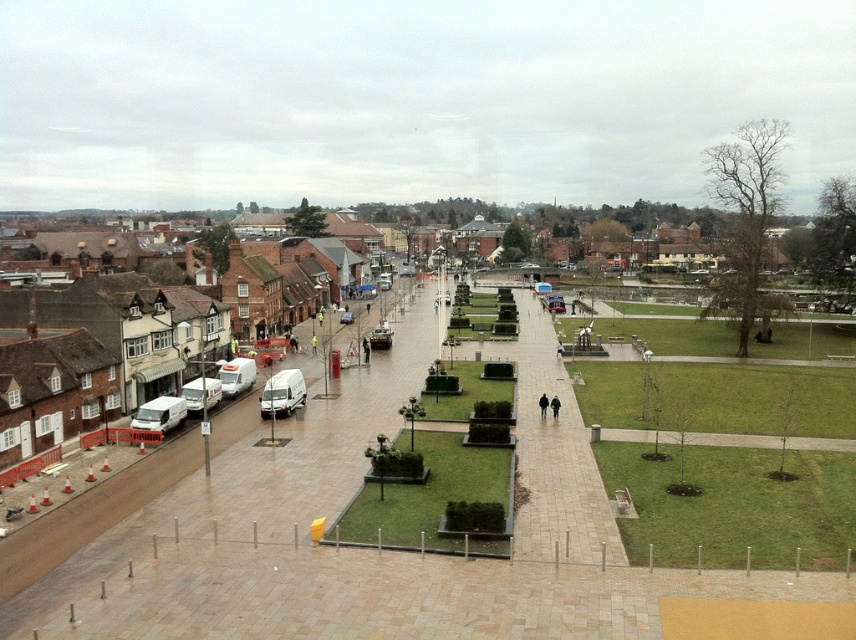
Is smooth concrete path at center further to camera compared to black matte jacket at center?

No, smooth concrete path at center is in front of black matte jacket at center.

Which is in front, point (312, 561) or point (539, 416)?

Point (312, 561)

Is point (355, 634) more distant than point (548, 401)?

No, it is in front of (548, 401).

In order to click on smooth concrete path at center in this screenshot , I will do `click(232, 522)`.

Does paved stone pathway at center have a greater height compared to black matte jacket at center?

Indeed, paved stone pathway at center has a greater height compared to black matte jacket at center.

Who is shorter, paved stone pathway at center or black matte jacket at center?

Standing shorter between the two is black matte jacket at center.

Is point (539, 520) closer to camera compared to point (545, 408)?

Yes.

The height and width of the screenshot is (640, 856). I want to click on paved stone pathway at center, so click(556, 456).

Which of these two, black matte jacket at center or dark gray coat at center, stands taller?

With more height is dark gray coat at center.

Which is behind, point (545, 412) or point (551, 401)?

Point (545, 412)

The width and height of the screenshot is (856, 640). I want to click on black matte jacket at center, so click(544, 404).